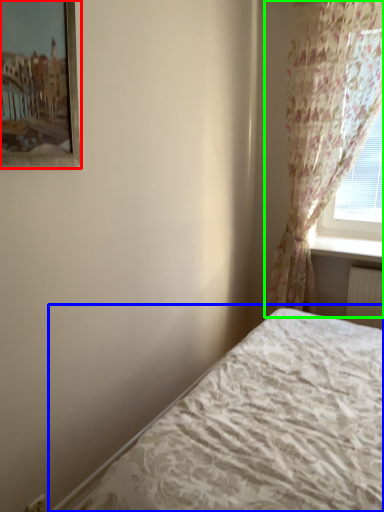
Question: Estimate the real-world distances between objects in this image. Which object is closer to picture frame (highlighted by a red box), bed (highlighted by a blue box) or curtain (highlighted by a green box)?

Choices:
 (A) bed
 (B) curtain

Answer: (A)